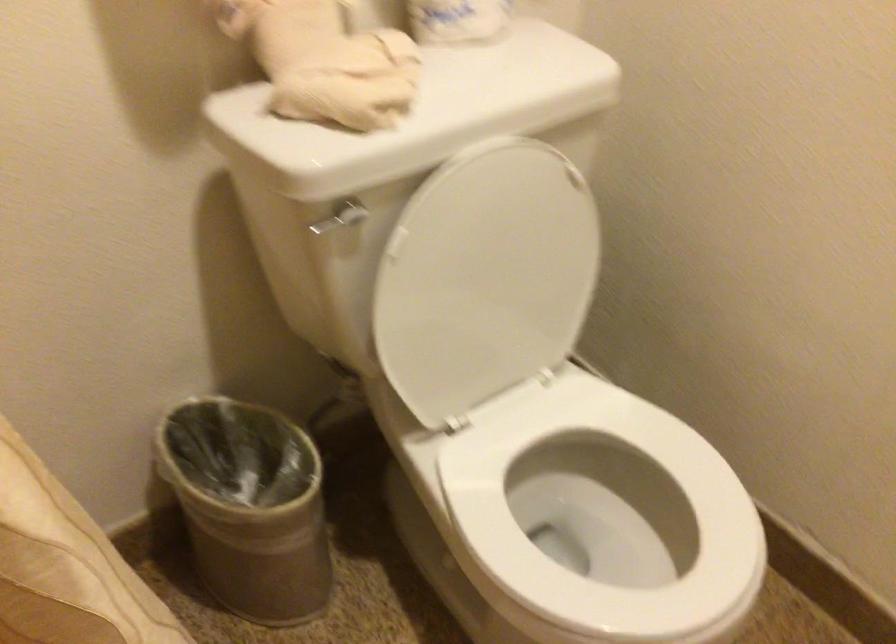
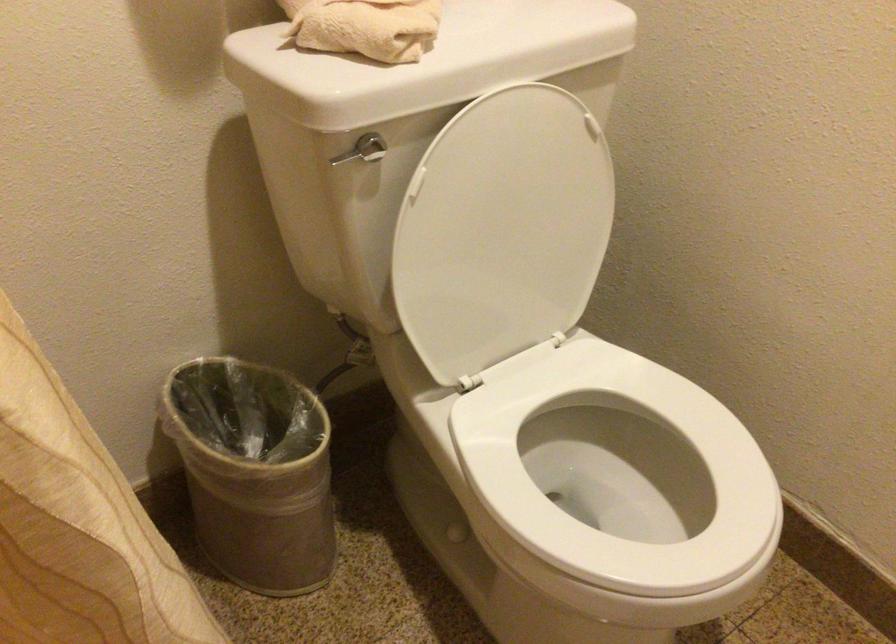
Where in the second image is the point corresponding to the point at 247,515 from the first image?

(254, 471)